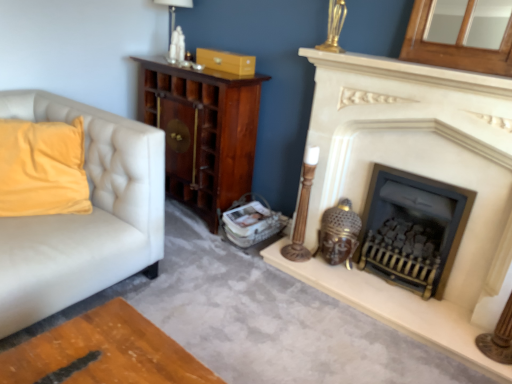
At what (x,y) coordinates should I click in order to perform the action: click on free location in front of matte white fireplace at right. Please return your answer as a coordinate pair (x, y). The width and height of the screenshot is (512, 384). Looking at the image, I should click on (412, 306).